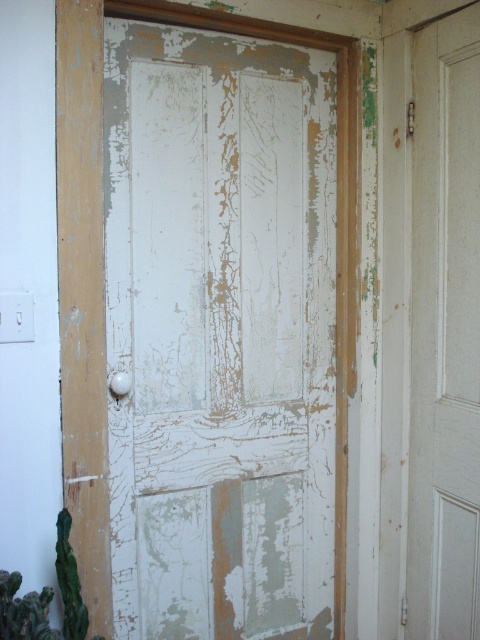
Who is taller, white peeling paint at center or white matte door at center?

white peeling paint at center is taller.

Does point (276, 157) come closer to viewer compared to point (440, 588)?

No, (276, 157) is behind (440, 588).

Which is behind, point (203, 96) or point (432, 99)?

Point (432, 99)

Identify the location of white peeling paint at center. This screenshot has height=640, width=480. (235, 314).